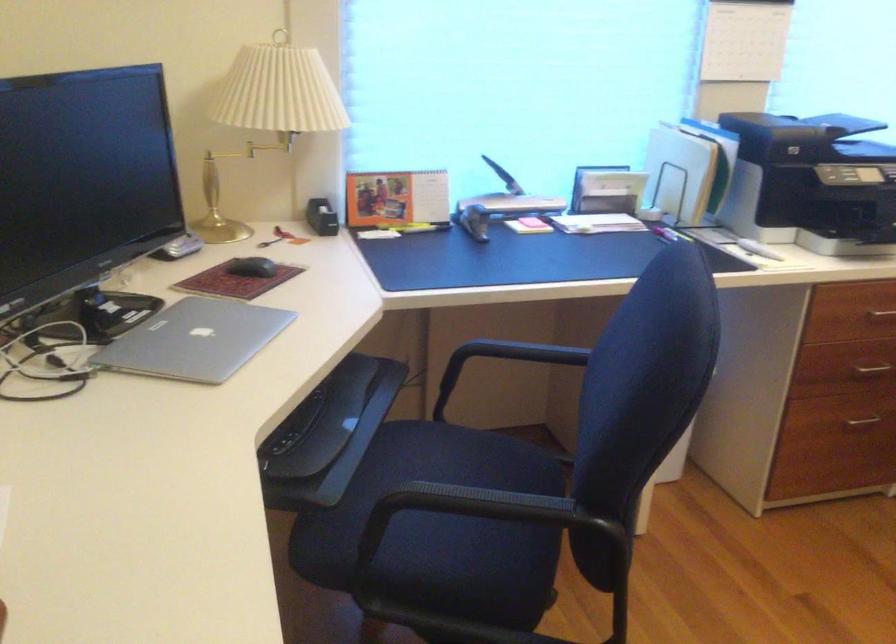
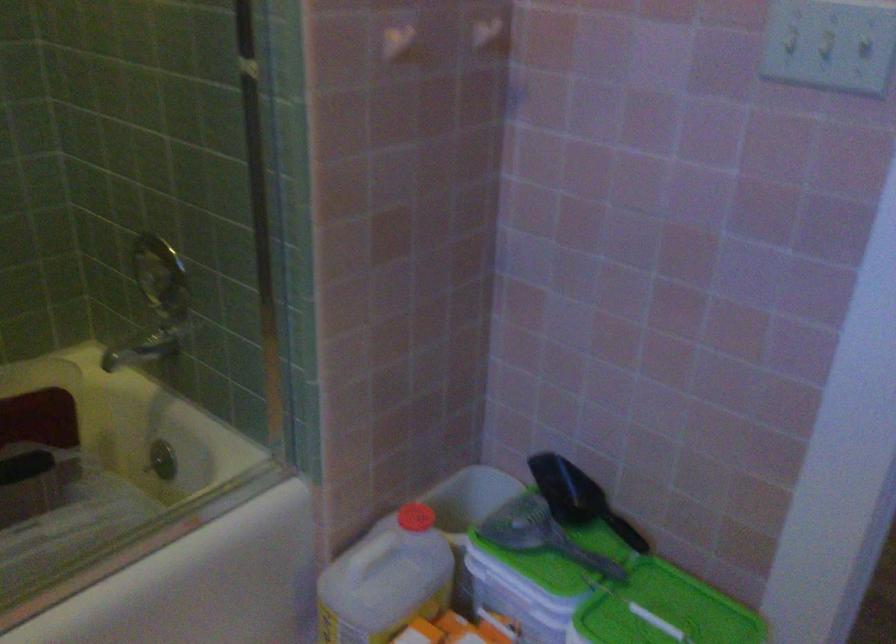
Question: I am providing you with two images of the same scene from different viewpoints. After the viewpoint changes to image2, which objects are now occluded?

Choices:
 (A) green circular magnet
 (B) white plastic jug
 (C) chair armrest
 (D) red bottle cap

Answer: (C)